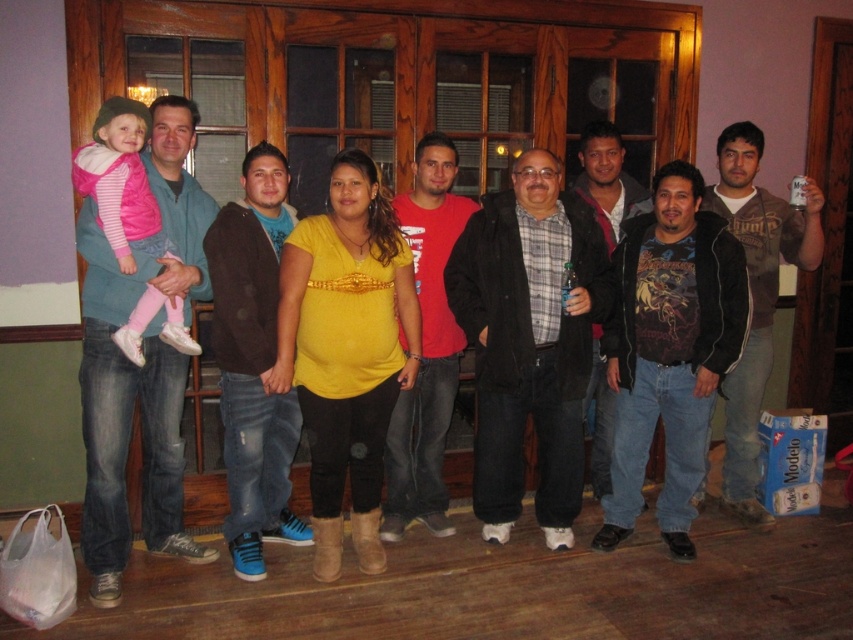
Does red cotton shirt at center appear over pink fleece jacket at left?

No.

Can you confirm if red cotton shirt at center is positioned below pink fleece jacket at left?

Yes.

You are a GUI agent. You are given a task and a screenshot of the screen. Output one action in this format:
    pyautogui.click(x=<x>, y=<y>)
    Task: Click on the red cotton shirt at center
    Image resolution: width=853 pixels, height=640 pixels.
    Given the screenshot: What is the action you would take?
    pyautogui.click(x=426, y=346)

Where is `red cotton shirt at center`? The height and width of the screenshot is (640, 853). red cotton shirt at center is located at coordinates (426, 346).

Locate an element on the screen. The image size is (853, 640). dark blue jeans at center is located at coordinates (670, 349).

Is denim jacket at left to the left of denim jeans at center from the viewer's perspective?

Correct, you'll find denim jacket at left to the left of denim jeans at center.

Is point (189, 195) more distant than point (271, 173)?

Yes, point (189, 195) is farther from viewer.

Locate an element on the screen. Image resolution: width=853 pixels, height=640 pixels. denim jacket at left is located at coordinates tap(140, 368).

You are a GUI agent. You are given a task and a screenshot of the screen. Output one action in this format:
    pyautogui.click(x=<x>, y=<y>)
    Task: Click on the denim jacket at left
    
    Given the screenshot: What is the action you would take?
    pyautogui.click(x=140, y=368)